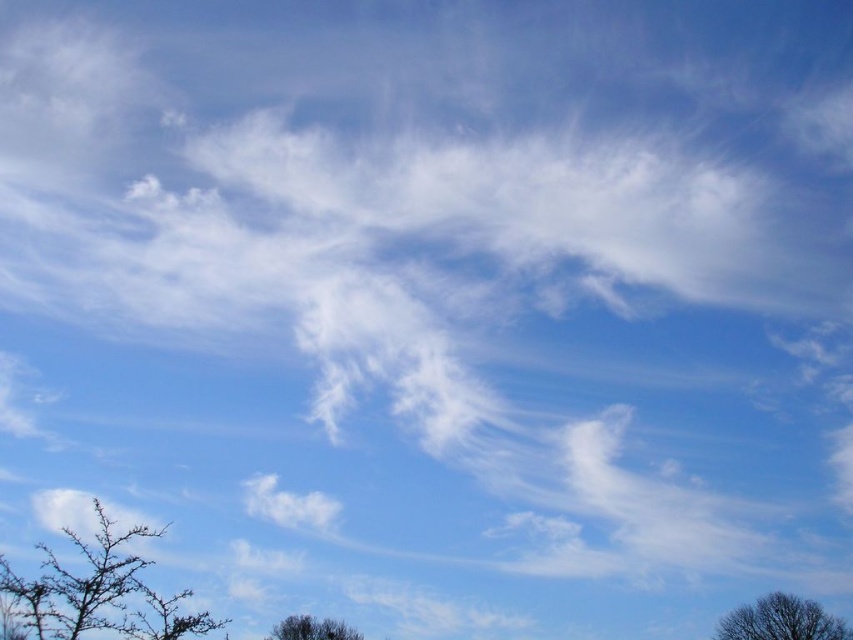
Question: Based on their relative distances, which object is farther from the brown textured tree at lower right?

Choices:
 (A) dark brown textured tree at lower center
 (B) brown spiky branches at lower left

Answer: (B)

Question: Does brown textured tree at lower right appear on the left side of dark brown textured tree at lower center?

Choices:
 (A) no
 (B) yes

Answer: (A)

Question: From the image, what is the correct spatial relationship of brown textured tree at lower right in relation to dark brown textured tree at lower center?

Choices:
 (A) above
 (B) below

Answer: (B)

Question: Estimate the real-world distances between objects in this image. Which object is farther from the brown spiky branches at lower left?

Choices:
 (A) dark brown textured tree at lower center
 (B) brown textured tree at lower right

Answer: (B)

Question: Which object is the closest to the brown spiky branches at lower left?

Choices:
 (A) dark brown textured tree at lower center
 (B) brown textured tree at lower right

Answer: (A)

Question: Does brown textured tree at lower right lie behind dark brown textured tree at lower center?

Choices:
 (A) no
 (B) yes

Answer: (B)